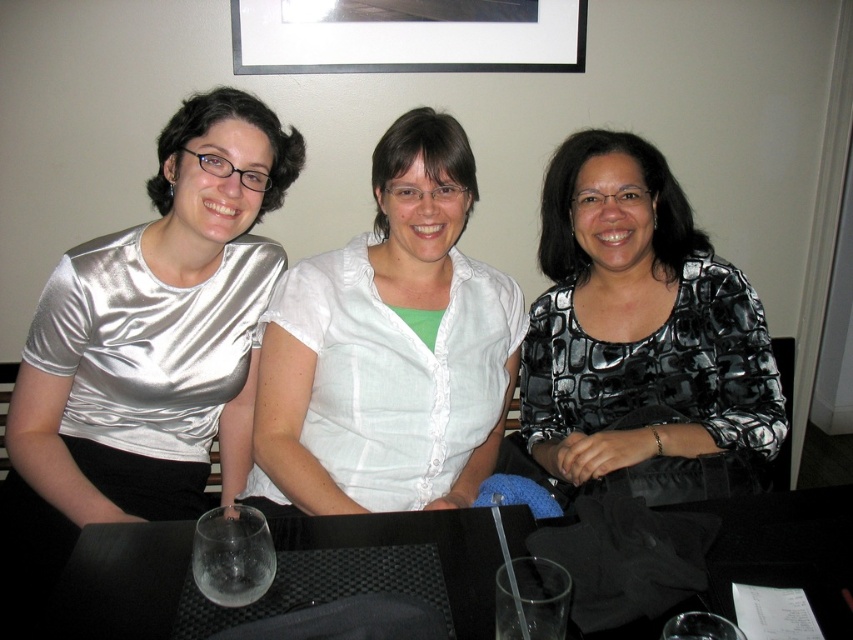
You are taking a photo of the shiny silver blouse at left and the white linen shirt at center. Which one is closer to the camera?

The shiny silver blouse at left is positioned under the white linen shirt at center, so the white linen shirt at center is closer to the camera.

You are standing at the origin point of the coordinate system in the image. Which direction should you move to reach the black matte table at center?

The black matte table at center is located at coordinate point (785, 548), so you should move towards the lower right direction to reach it.

You are a photographer trying to capture a group photo of the three individuals. Since the shiny silver blouse at left and the white linen shirt at center are visible in the frame, which one do you think will appear bigger in the photo?

The shiny silver blouse at left will appear bigger in the photo because it is larger in size than the white linen shirt at center.